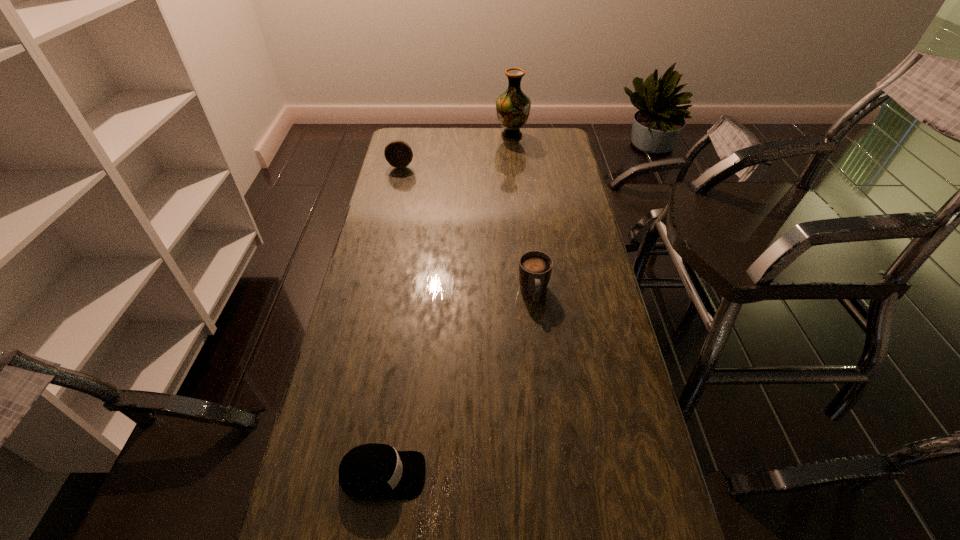
At what (x,y) coordinates should I click in order to perform the action: click on the farthest object. Please return your answer as a coordinate pair (x, y). The height and width of the screenshot is (540, 960). Looking at the image, I should click on (513, 107).

Find the location of `the tallest object`. the tallest object is located at coordinates (513, 107).

Identify the location of the second farthest object. (398, 153).

Image resolution: width=960 pixels, height=540 pixels. Find the location of `the third farthest object`. the third farthest object is located at coordinates (535, 267).

I want to click on the shortest object, so click(x=373, y=471).

At what (x,y) coordinates should I click in order to perform the action: click on the nearest object. Please return your answer as a coordinate pair (x, y). The width and height of the screenshot is (960, 540). Looking at the image, I should click on (373, 471).

The width and height of the screenshot is (960, 540). Find the location of `vacant region located 0.350m on the left of the tallest object`. vacant region located 0.350m on the left of the tallest object is located at coordinates [422, 136].

Locate an element on the screen. The width and height of the screenshot is (960, 540). vacant region located 0.230m on the back of the bowl is located at coordinates (408, 135).

The width and height of the screenshot is (960, 540). Identify the location of vacant space located 0.170m on the side of the second nearest object with the handle. (540, 356).

Where is `vacant region located on the front-facing side of the cap`? This screenshot has width=960, height=540. vacant region located on the front-facing side of the cap is located at coordinates (490, 475).